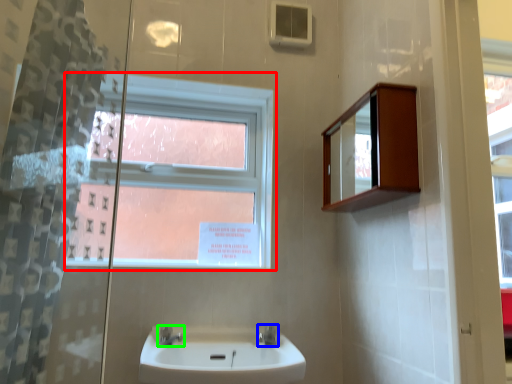
Question: Based on their relative distances, which object is nearer to window (highlighted by a red box)? Choose from tap (highlighted by a blue box) and tap (highlighted by a green box).

Choices:
 (A) tap
 (B) tap

Answer: (B)